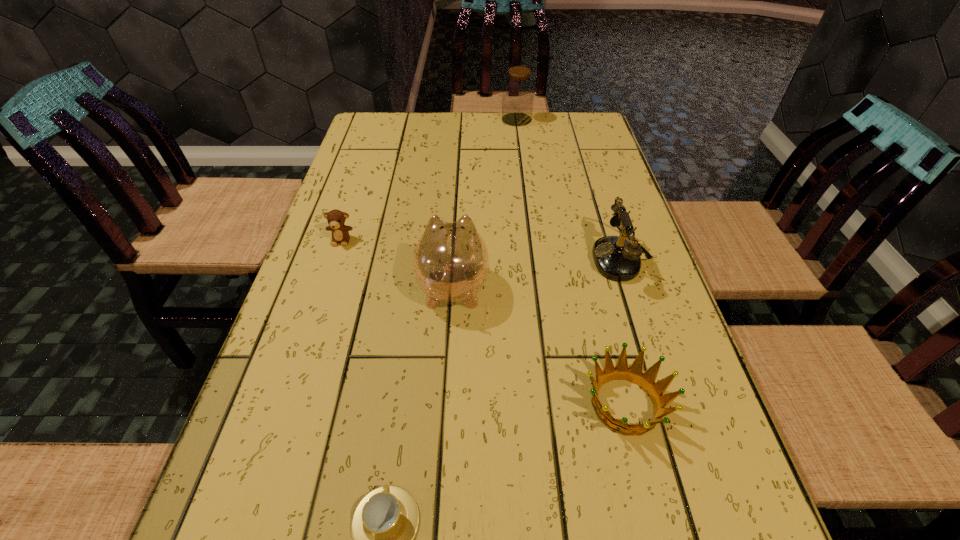
I want to click on the farthest object, so click(x=518, y=89).

In order to click on jar in this screenshot , I will do `click(518, 89)`.

Where is `piggy bank`? piggy bank is located at coordinates (451, 261).

I want to click on telephone, so click(x=615, y=257).

You are a GUI agent. You are given a task and a screenshot of the screen. Output one action in this format:
    pyautogui.click(x=<x>, y=<y>)
    Task: Click on the teddy bear
    
    Given the screenshot: What is the action you would take?
    pyautogui.click(x=340, y=232)

This screenshot has width=960, height=540. What are the coordinates of `the fifth farthest object` in the screenshot? It's located at (634, 374).

Identify the location of free space located 0.180m on the front of the farthest object. (521, 156).

You are a GUI agent. You are given a task and a screenshot of the screen. Output one action in this format:
    pyautogui.click(x=<x>, y=<y>)
    Task: Click on the free space located on the front facing side of the piggy bank
    
    Given the screenshot: What is the action you would take?
    pyautogui.click(x=457, y=214)

Identify the location of blank area located 0.230m on the front facing side of the piggy bank. (458, 198).

At what (x,y) coordinates should I click in order to perform the action: click on vacant space positioned on the front facing side of the piggy bank. Please return your answer as a coordinate pair (x, y). Looking at the image, I should click on (457, 212).